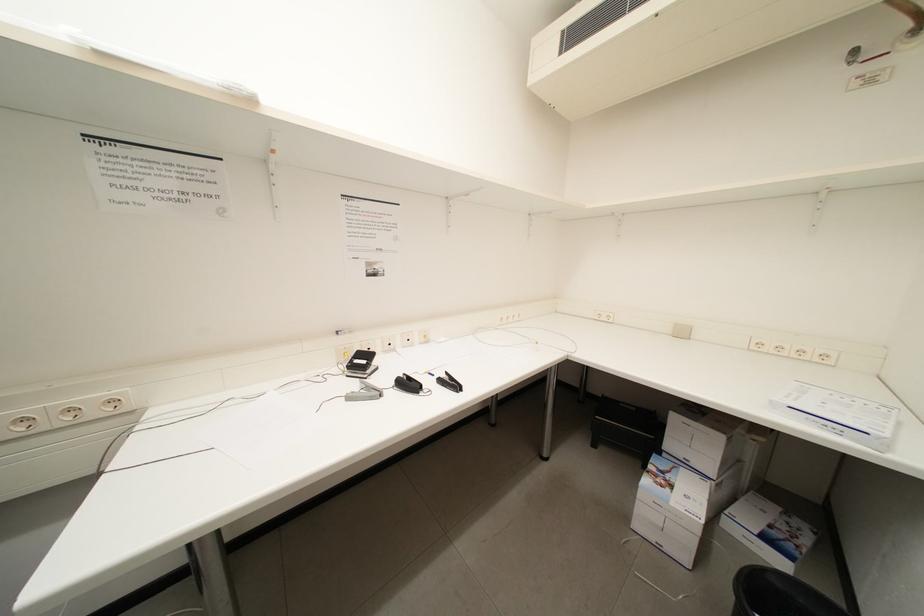
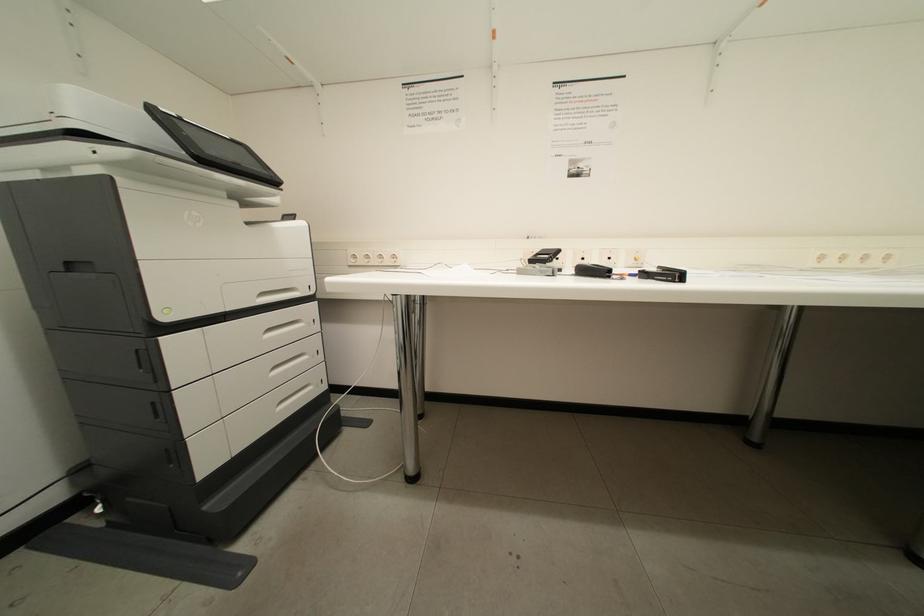
Question: Based on the continuous images, in which direction is the camera rotating? Reply with the corresponding letter.

Choices:
 (A) Left
 (B) Right
 (C) Up
 (D) Down

Answer: (A)